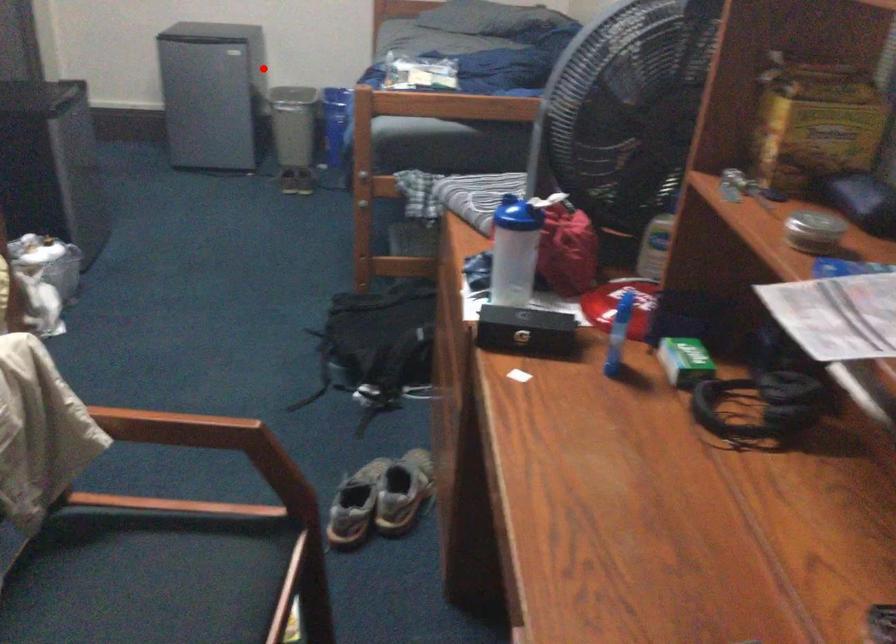
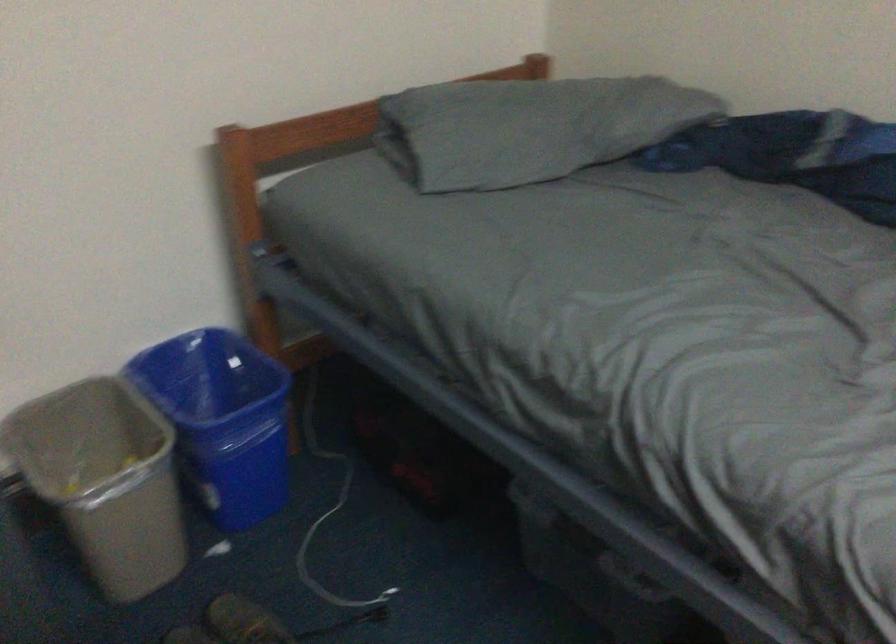
The point at the highlighted location is marked in the first image. Where is the corresponding point in the second image?

(104, 480)